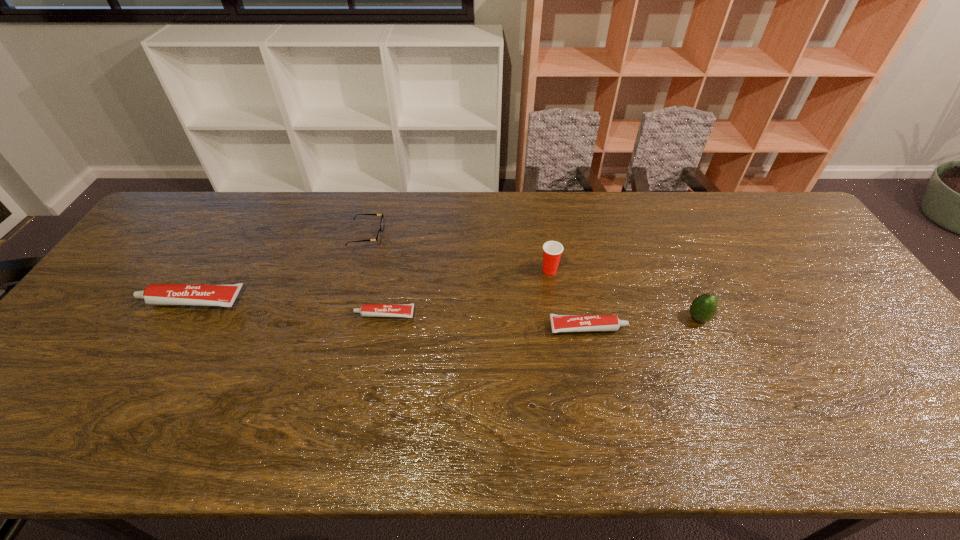
Locate an element on the screen. The height and width of the screenshot is (540, 960). blank space located 0.320m at the nozzle of the shortest object is located at coordinates (236, 314).

Where is `free location located at the nozzle of the shortest object`? The width and height of the screenshot is (960, 540). free location located at the nozzle of the shortest object is located at coordinates (296, 314).

Locate an element on the screen. vacant space located at the nozzle of the rightmost toothpaste is located at coordinates (736, 328).

Where is `vacant space situated 0.330m on the front-facing side of the spectacles`? vacant space situated 0.330m on the front-facing side of the spectacles is located at coordinates (485, 236).

The image size is (960, 540). I want to click on vacant space located on the front of the rightmost object, so click(723, 374).

Locate an element on the screen. The image size is (960, 540). free space located on the front of the fifth nearest object is located at coordinates (560, 333).

I want to click on object present at the far edge, so click(x=378, y=238).

Where is `object positioned at the left edge`? This screenshot has width=960, height=540. object positioned at the left edge is located at coordinates (224, 295).

In the image, there is a desktop. Find the location of `vacant space at the far edge`. vacant space at the far edge is located at coordinates (420, 196).

Locate an element on the screen. This screenshot has width=960, height=540. free space at the near edge of the desktop is located at coordinates (346, 388).